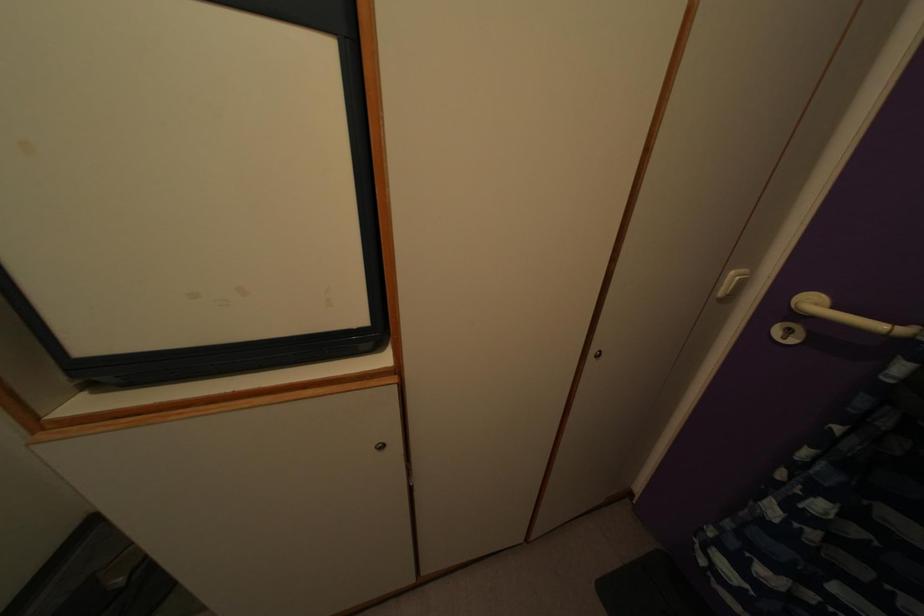
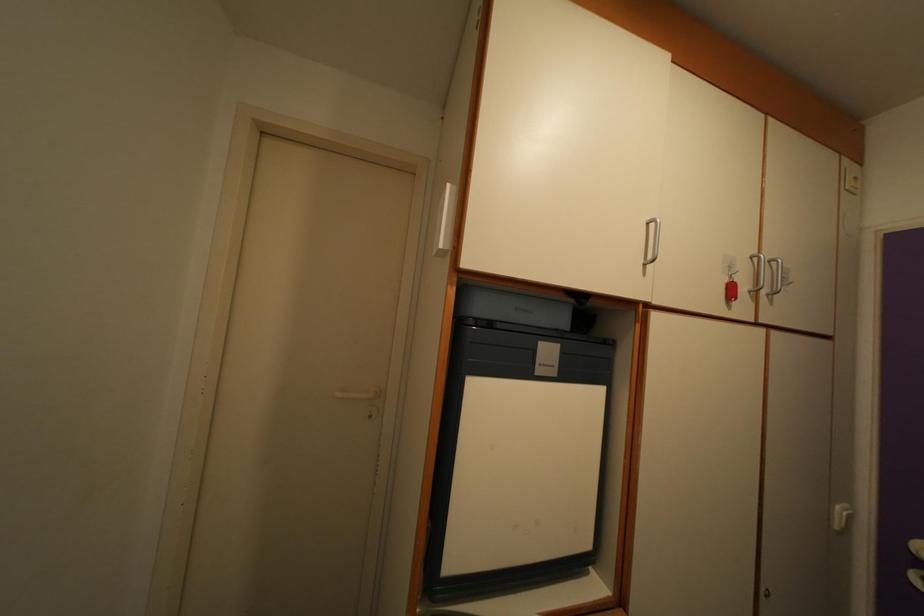
Find the pixel in the second image that matches point 736,284 in the first image.

(843, 519)